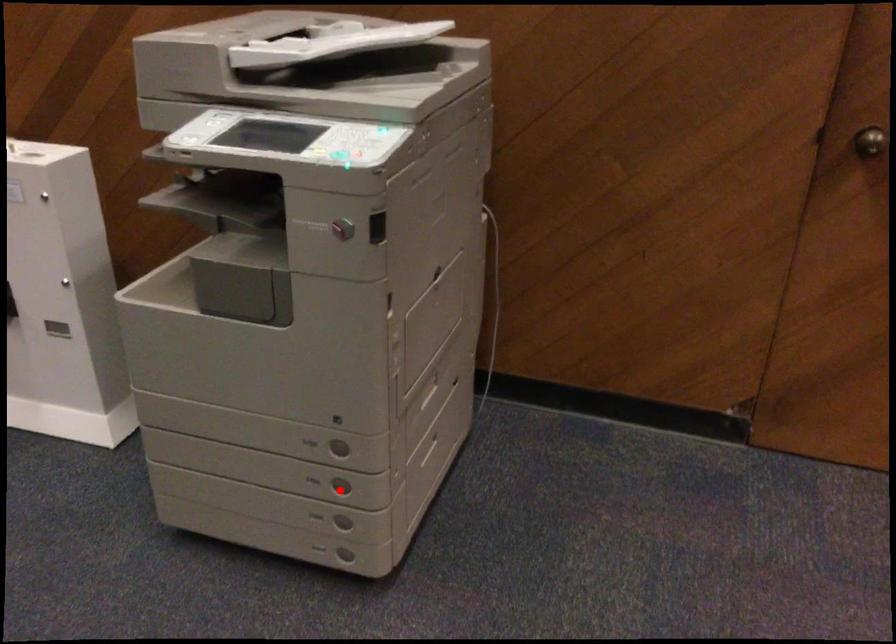
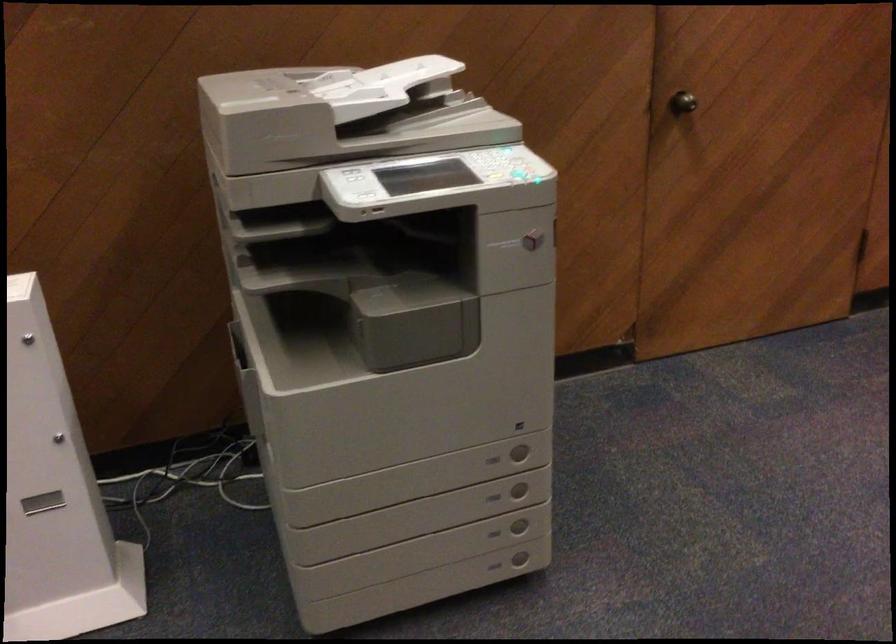
Find the pixel in the second image that matches the highlighted location in the first image.

(519, 489)